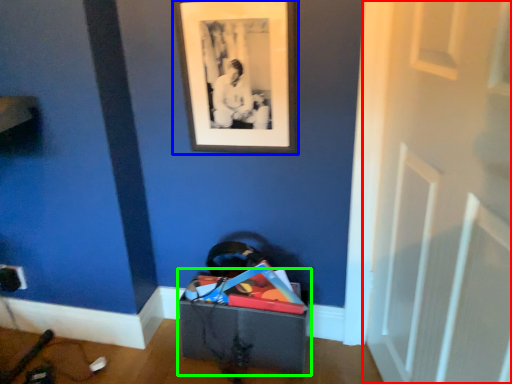
Question: Which object is positioned closest to door (highlighted by a red box)? Select from picture frame (highlighted by a blue box) and storage box (highlighted by a green box).

Choices:
 (A) picture frame
 (B) storage box

Answer: (A)